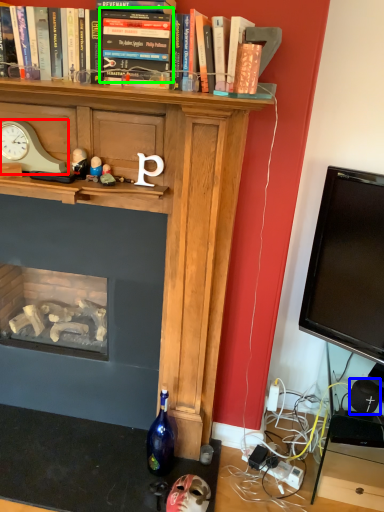
Question: Considering the real-world distances, which object is farthest from clock (highlighted by a red box)? speaker (highlighted by a blue box) or book (highlighted by a green box)?

Choices:
 (A) speaker
 (B) book

Answer: (A)